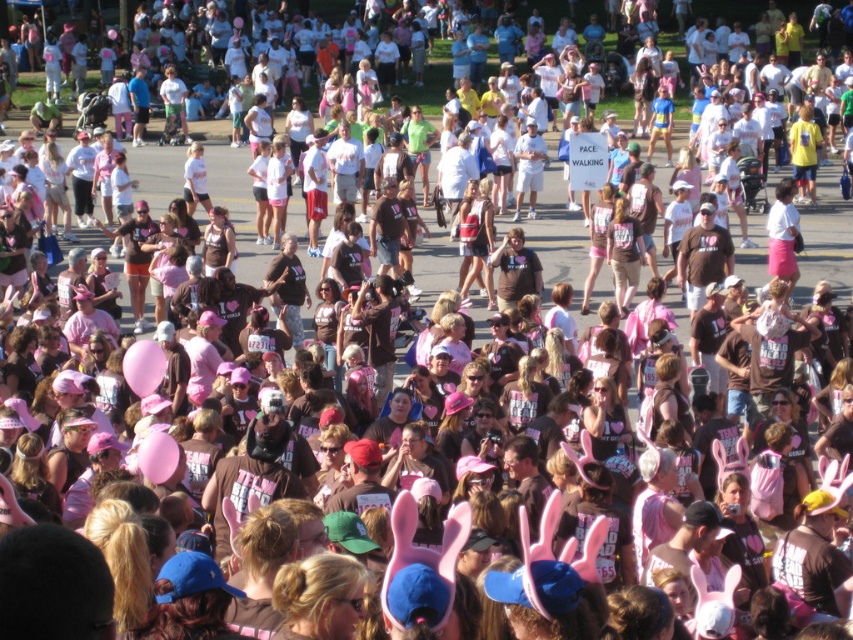
From the picture: Is pink rubber balloon at center positioned before pink fabric balloon at center?

No, pink rubber balloon at center is behind pink fabric balloon at center.

Who is more distant from viewer, (131, 362) or (160, 440)?

The point (131, 362) is more distant.

The width and height of the screenshot is (853, 640). I want to click on pink rubber balloon at center, so click(x=143, y=365).